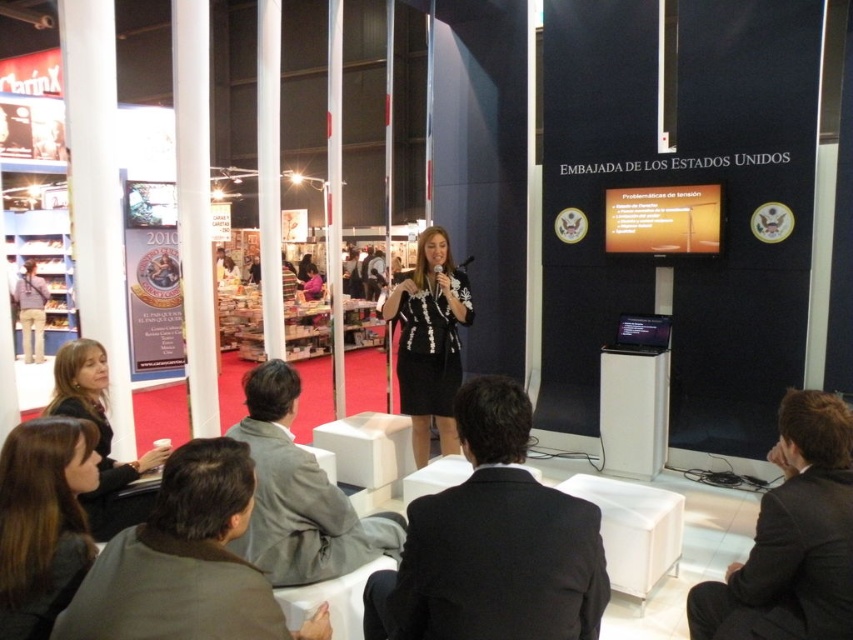
You are attending an event at the United States Embassy and notice two items of clothing. The first is a black satin dress at center, and the second is a matte black jacket at lower left. From your perspective as an attendee in the audience, which item of clothing appears closer to you?

The black satin dress at center appears closer to you because the matte black jacket at lower left is positioned behind it.

You are attending an event at the United States Embassy and need to locate the gray wool suit at lower center. According to the coordinates provided, where exactly should you look on the screen?

The gray wool suit at lower center is located at point coordinates of 0.775 on the x axis and 0.352 on the y axis.